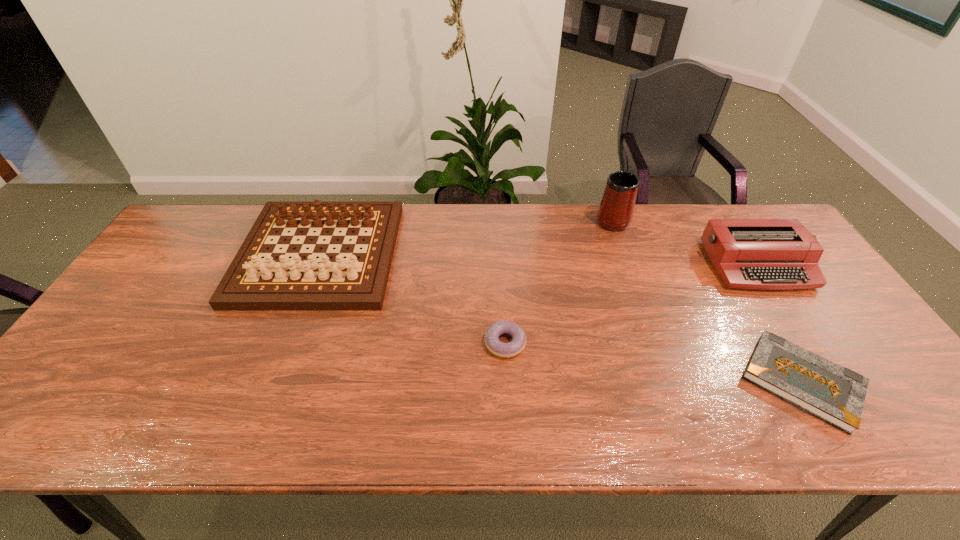
Find the location of a particular element. unoccupied position between the doughnut and the typewriter is located at coordinates (631, 304).

Locate an element on the screen. Image resolution: width=960 pixels, height=540 pixels. vacant area that lies between the fourth object from right to left and the mug is located at coordinates (559, 281).

The image size is (960, 540). I want to click on empty location between the doughnut and the leftmost object, so click(412, 299).

Locate an element on the screen. object that is the fourth closest to the shortest object is located at coordinates (275, 282).

Select which object is the closest to the leftmost object. Please provide its 2D coordinates. Your answer should be formatted as a tuple, i.e. [(x, y)], where the tuple contains the x and y coordinates of a point satisfying the conditions above.

[(494, 345)]

The image size is (960, 540). Identify the location of free space that satisfies the following two spatial constraints: 1. on the side with the white pieces of the leftmost object; 2. on the right side of the notebook. (271, 382).

Where is `vacant space that satisfies the following two spatial constraints: 1. on the side with the white pieces of the shortest object; 2. on the left side of the gameboard`? vacant space that satisfies the following two spatial constraints: 1. on the side with the white pieces of the shortest object; 2. on the left side of the gameboard is located at coordinates (271, 382).

The image size is (960, 540). What are the coordinates of `free spot that satisfies the following two spatial constraints: 1. on the side with the white pieces of the leftmost object; 2. on the left side of the notebook` in the screenshot? It's located at (271, 382).